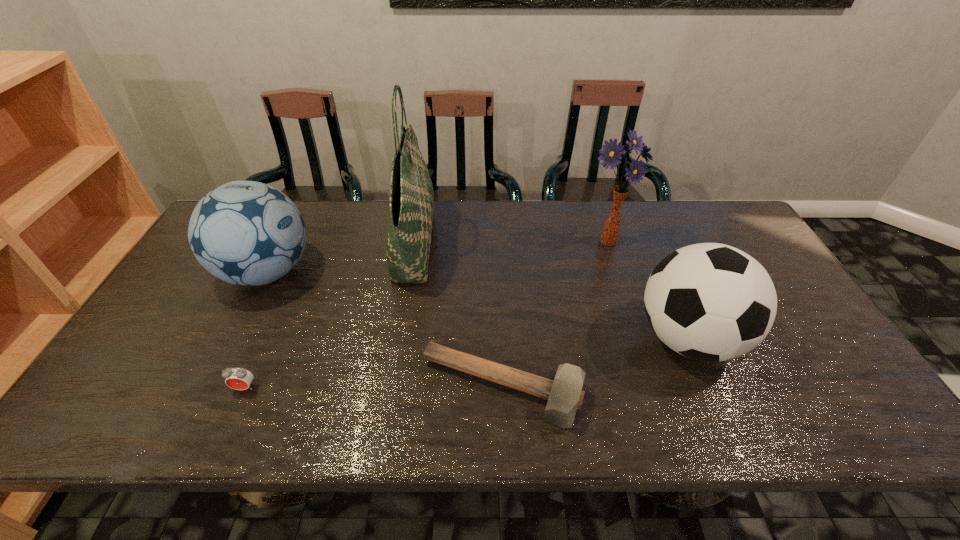
Where is `free space between the fifth shortest object and the third object from left to right`? The height and width of the screenshot is (540, 960). free space between the fifth shortest object and the third object from left to right is located at coordinates (512, 242).

Where is `free area in between the tallest object and the fifth tallest object`? free area in between the tallest object and the fifth tallest object is located at coordinates (329, 315).

Where is `vacant area between the flower arrangement and the tote bag`? vacant area between the flower arrangement and the tote bag is located at coordinates (512, 242).

Identify which object is the fifth nearest to the shortest object. Please provide its 2D coordinates. Your answer should be formatted as a tuple, i.e. [(x, y)], where the tuple contains the x and y coordinates of a point satisfying the conditions above.

[(237, 378)]

Choose which object is the nearest neighbor to the right soccer ball. Please provide its 2D coordinates. Your answer should be formatted as a tuple, i.e. [(x, y)], where the tuple contains the x and y coordinates of a point satisfying the conditions above.

[(565, 395)]

At what (x,y) coordinates should I click in order to perform the action: click on vacant area that satisfies the following two spatial constraints: 1. on the side with brand of the left soccer ball; 2. on the back side of the right soccer ball. Please return your answer as a coordinate pair (x, y). This screenshot has height=540, width=960. Looking at the image, I should click on (234, 339).

At what (x,y) coordinates should I click in order to perform the action: click on free point that satisfies the following two spatial constraints: 1. on the side with brand of the left soccer ball; 2. on the left side of the right soccer ball. Please return your answer as a coordinate pair (x, y). Looking at the image, I should click on (234, 339).

You are a GUI agent. You are given a task and a screenshot of the screen. Output one action in this format:
    pyautogui.click(x=<x>, y=<y>)
    Task: Click on the blank space that satisfies the following two spatial constraints: 1. on the side with brand of the left soccer ball; 2. on the right side of the shortest object
    This screenshot has height=540, width=960.
    Given the screenshot: What is the action you would take?
    pyautogui.click(x=209, y=388)